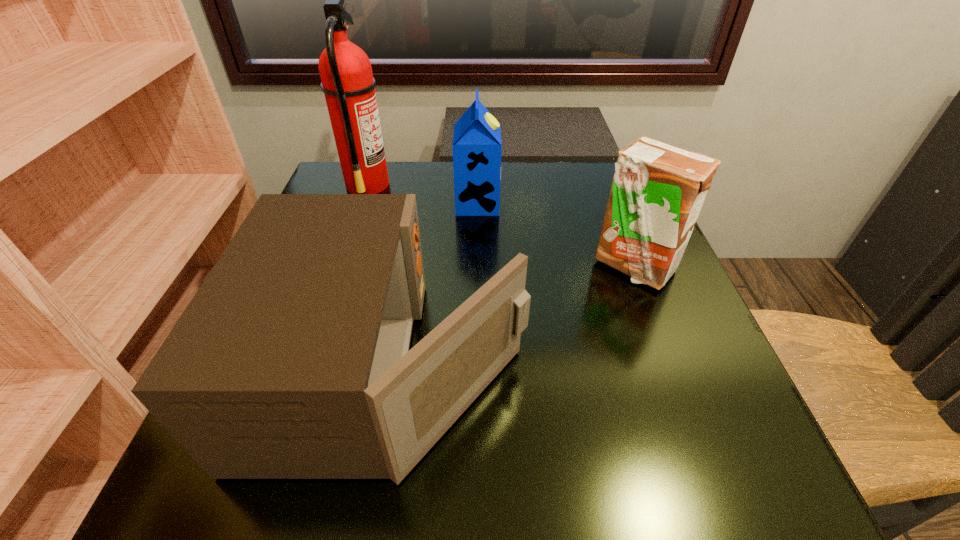
This screenshot has height=540, width=960. I want to click on the closest object to the fire extinguisher, so click(477, 146).

You are a GUI agent. You are given a task and a screenshot of the screen. Output one action in this format:
    pyautogui.click(x=<x>, y=<y>)
    Task: Click on the object that is the third nearest to the microwave oven
    The height and width of the screenshot is (540, 960).
    Given the screenshot: What is the action you would take?
    pyautogui.click(x=347, y=82)

Locate an element on the screen. This screenshot has height=540, width=960. free point that satisfies the following two spatial constraints: 1. on the straw side of the nearer carton; 2. with the door open on the front of the microwave oven is located at coordinates (673, 368).

Image resolution: width=960 pixels, height=540 pixels. I want to click on free region that satisfies the following two spatial constraints: 1. on the straw side of the nearer carton; 2. with the door open on the front of the shortest object, so click(x=673, y=368).